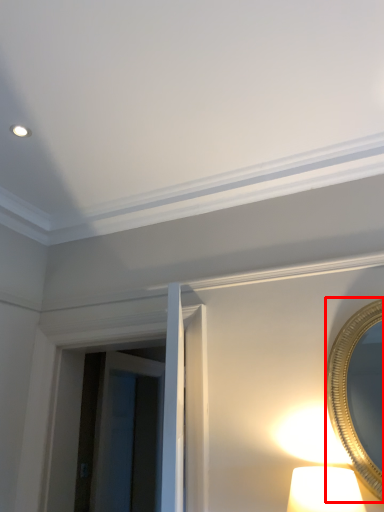
Question: Considering the relative positions of mirror (annotated by the red box) and glass door in the image provided, where is mirror (annotated by the red box) located with respect to the staircase?

Choices:
 (A) right
 (B) left

Answer: (A)